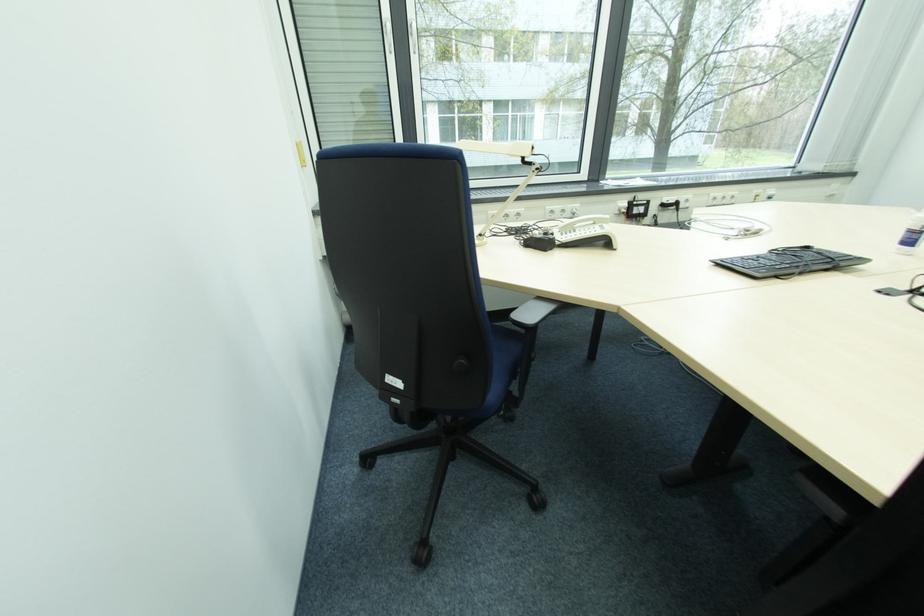
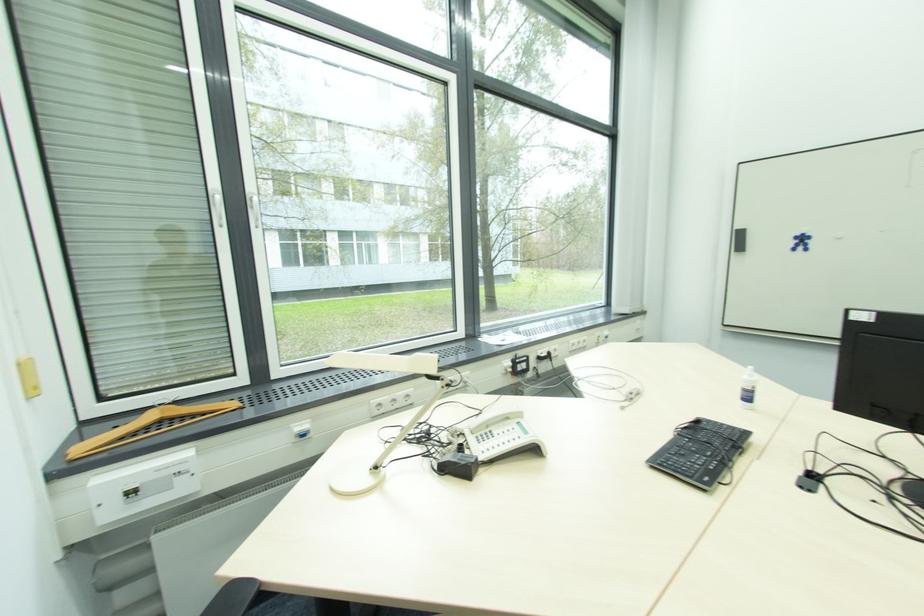
In the second image, find the point that corresponds to (808,251) in the first image.

(700, 424)